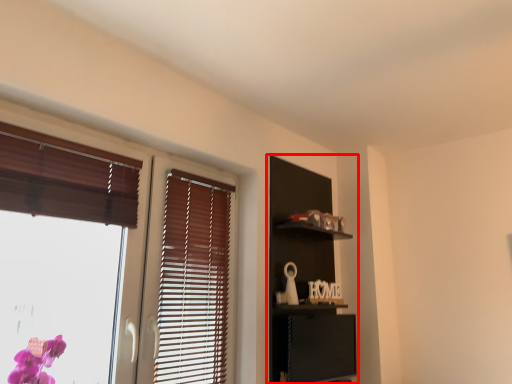
Question: From the image's perspective, considering the relative positions of dresser (annotated by the red box) and window in the image provided, where is dresser (annotated by the red box) located with respect to the staircase?

Choices:
 (A) below
 (B) above

Answer: (A)